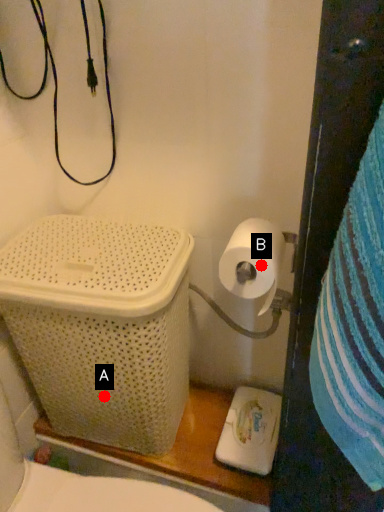
Question: Two points are circled on the image, labeled by A and B beside each circle. Among these points, which one is nearest to the camera?

Choices:
 (A) A is closer
 (B) B is closer

Answer: (B)